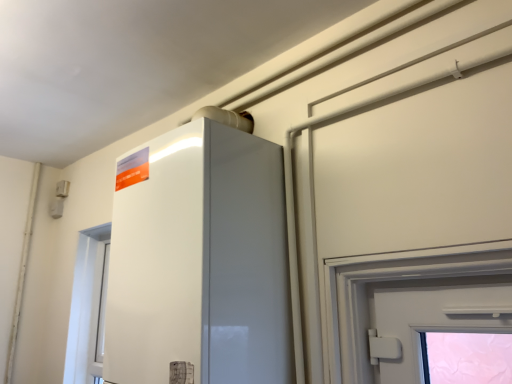
What is the approximate width of white glossy elevator at upper center?

white glossy elevator at upper center is 34.13 centimeters in width.

The height and width of the screenshot is (384, 512). What do you see at coordinates (199, 260) in the screenshot?
I see `white glossy elevator at upper center` at bounding box center [199, 260].

Identify the location of white glossy elevator at upper center. (199, 260).

In order to face white glossy elevator at upper center, should I rotate leftwards or rightwards?

Rotate your view left by about 8.328°.

Where is `white glossy elevator at upper center`? Image resolution: width=512 pixels, height=384 pixels. white glossy elevator at upper center is located at coordinates (199, 260).